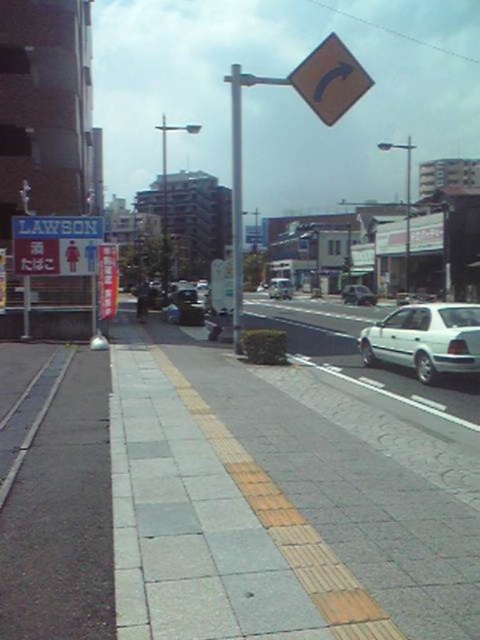
You are standing at the yellow tactile paving strip on the sidewalk. There is a yellow brick pavement marked by point (282,502). In which direction should you walk to reach the yellow brick pavement?

The yellow brick pavement is located at the center of the image, so you should walk towards the center to reach it.